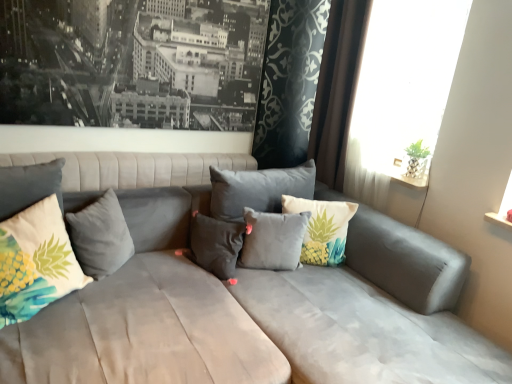
Question: Is white sheer curtain at upper right to the left of gray velvet pillow at center, positioned as the second pillow in left-to-right order, from the viewer's perspective?

Choices:
 (A) yes
 (B) no

Answer: (B)

Question: Is white sheer curtain at upper right not close to gray velvet pillow at center, the 4th pillow positioned from the right?

Choices:
 (A) yes
 (B) no

Answer: (A)

Question: Considering the relative sizes of white sheer curtain at upper right and gray velvet pillow at center, the 4th pillow positioned from the right, in the image provided, is white sheer curtain at upper right wider than gray velvet pillow at center, the 4th pillow positioned from the right,?

Choices:
 (A) no
 (B) yes

Answer: (A)

Question: Considering the relative sizes of white sheer curtain at upper right and gray velvet pillow at center, positioned as the second pillow in left-to-right order, in the image provided, is white sheer curtain at upper right thinner than gray velvet pillow at center, positioned as the second pillow in left-to-right order,?

Choices:
 (A) yes
 (B) no

Answer: (A)

Question: Would you say white sheer curtain at upper right is outside gray velvet pillow at center, the 4th pillow positioned from the right?

Choices:
 (A) no
 (B) yes

Answer: (B)

Question: Considering the positions of brown velvet curtain at upper right and printed fabric pineapple pillow at left, placed as the 1th pillow when sorted from left to right, in the image, is brown velvet curtain at upper right wider or thinner than printed fabric pineapple pillow at left, placed as the 1th pillow when sorted from left to right,?

Choices:
 (A) wide
 (B) thin

Answer: (B)

Question: Is point pos(338,3) closer or farther from the camera than point pos(39,296)?

Choices:
 (A) farther
 (B) closer

Answer: (A)

Question: Is brown velvet curtain at upper right spatially inside printed fabric pineapple pillow at left, marked as the 5th pillow in a right-to-left arrangement, or outside of it?

Choices:
 (A) outside
 (B) inside

Answer: (A)

Question: Relative to printed fabric pineapple pillow at left, marked as the 5th pillow in a right-to-left arrangement, is brown velvet curtain at upper right in front or behind?

Choices:
 (A) front
 (B) behind

Answer: (B)

Question: Looking at their shapes, would you say brown velvet curtain at upper right is wider or thinner than gray matte pillow at center, which ranks as the fourth pillow in left-to-right order?

Choices:
 (A) wide
 (B) thin

Answer: (B)

Question: In terms of height, does brown velvet curtain at upper right look taller or shorter compared to gray matte pillow at center, which appears as the second pillow when viewed from the right?

Choices:
 (A) short
 (B) tall

Answer: (B)

Question: From the image's perspective, is brown velvet curtain at upper right located above or below gray matte pillow at center, which ranks as the fourth pillow in left-to-right order?

Choices:
 (A) above
 (B) below

Answer: (A)

Question: Is brown velvet curtain at upper right to the left or to the right of gray matte pillow at center, which ranks as the fourth pillow in left-to-right order, in the image?

Choices:
 (A) left
 (B) right

Answer: (B)

Question: From a real-world perspective, is printed fabric pineapple pillow at left, placed as the 1th pillow when sorted from left to right, above or below pineapple-patterned fabric pillow at center, which is counted as the 5th pillow, starting from the left?

Choices:
 (A) below
 (B) above

Answer: (B)

Question: In terms of size, does printed fabric pineapple pillow at left, placed as the 1th pillow when sorted from left to right, appear bigger or smaller than pineapple-patterned fabric pillow at center, which is counted as the 5th pillow, starting from the left?

Choices:
 (A) small
 (B) big

Answer: (B)